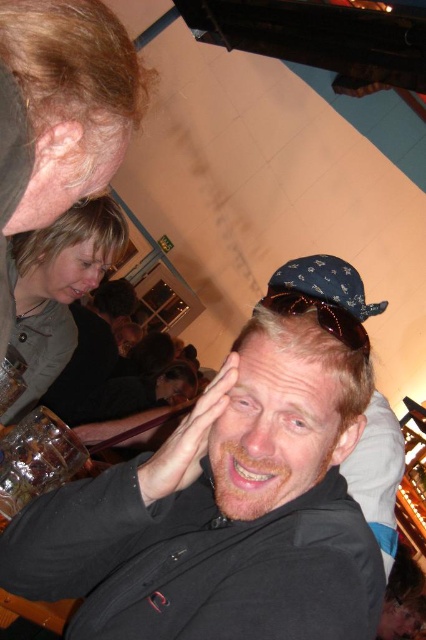
Is matte black hair at upper left taller than brown fur head at center?

Indeed, matte black hair at upper left has a greater height compared to brown fur head at center.

Who is more distant from viewer, (x=115, y=310) or (x=172, y=378)?

The point (x=115, y=310) is more distant.

This screenshot has height=640, width=426. Identify the location of matte black hair at upper left. point(114,300).

Can you confirm if dark blue fabric baseball cap at center is positioned below matte black hair at center?

Actually, dark blue fabric baseball cap at center is above matte black hair at center.

Which is below, dark blue fabric baseball cap at center or matte black hair at center?

matte black hair at center

From the picture: Who is more distant from viewer, (321, 291) or (173, 346)?

The point (173, 346) is more distant.

Locate an element on the screen. The width and height of the screenshot is (426, 640). dark blue fabric baseball cap at center is located at coordinates (325, 284).

Can you confirm if light brown hair at upper left is positioned to the left of blonde hair at lower left?

Incorrect, light brown hair at upper left is not on the left side of blonde hair at lower left.

You are a GUI agent. You are given a task and a screenshot of the screen. Output one action in this format:
    pyautogui.click(x=<x>, y=<y>)
    Task: Click on the light brown hair at upper left
    Image resolution: width=426 pixels, height=640 pixels.
    Given the screenshot: What is the action you would take?
    pyautogui.click(x=69, y=99)

Where is `light brown hair at upper left`? Image resolution: width=426 pixels, height=640 pixels. light brown hair at upper left is located at coordinates (69, 99).